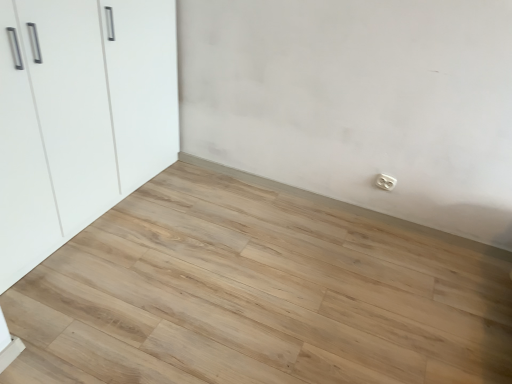
Question: In terms of size, does natural wood floor at center appear bigger or smaller than white plastic electric outlet at lower right?

Choices:
 (A) small
 (B) big

Answer: (B)

Question: Considering the positions of natural wood floor at center and white plastic electric outlet at lower right in the image, is natural wood floor at center wider or thinner than white plastic electric outlet at lower right?

Choices:
 (A) wide
 (B) thin

Answer: (A)

Question: Which is nearer to the white plastic electric outlet at lower right?

Choices:
 (A) white glossy cupboard at left
 (B) natural wood floor at center

Answer: (B)

Question: Which object is positioned closest to the natural wood floor at center?

Choices:
 (A) white glossy cupboard at left
 (B) white plastic electric outlet at lower right

Answer: (A)